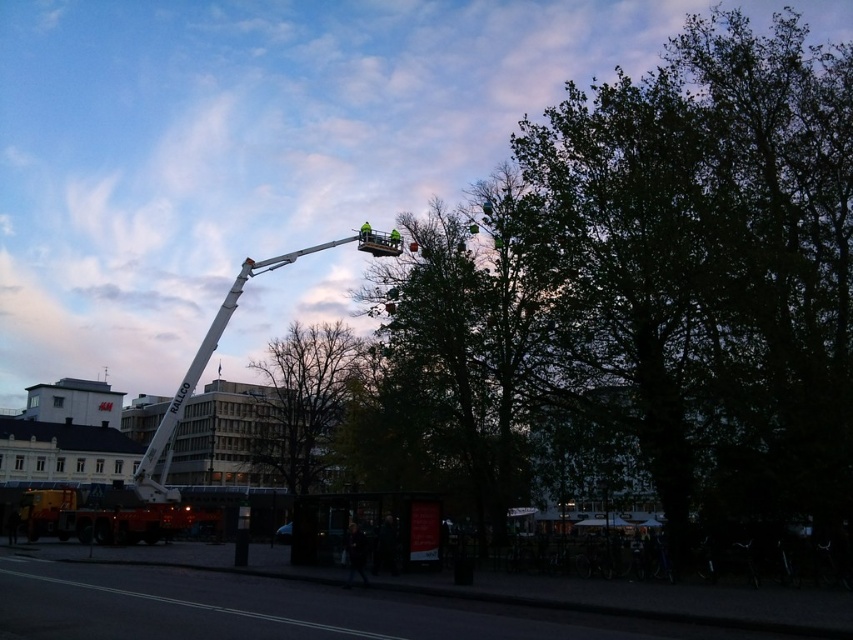
You are a worker standing on the ground and need to reach a light fixture that is under the white metallic crane at center. The bare branches at center are blocking your path. Can you move the branches to access the crane?

The bare branches at center are positioned under the white metallic crane at center, so you cannot move them as they are already under the crane. You may need to find another way to access the light fixture without disturbing the branches.

You are a construction worker standing at the base of the green leafy tree at upper center. You need to move to the white metallic crane at center. Given that the crane is 16.65 meters away, can you safely walk directly to the crane without any obstacles?

The green leafy tree at upper center is 16.65 meters away from the white metallic crane at center. Since there are no obstacles mentioned in the scene description, you can safely walk directly to the crane.